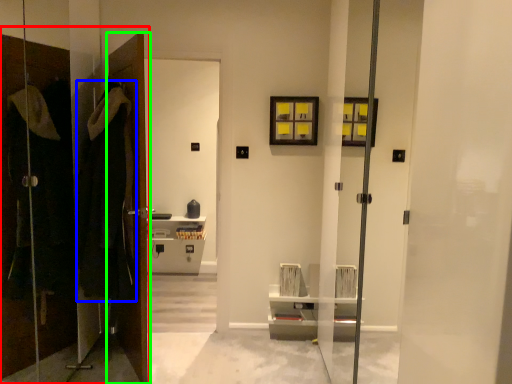
Question: Which object is the farthest from closet (highlighted by a red box)? Choose among these: robe (highlighted by a blue box) or door (highlighted by a green box).

Choices:
 (A) robe
 (B) door

Answer: (B)